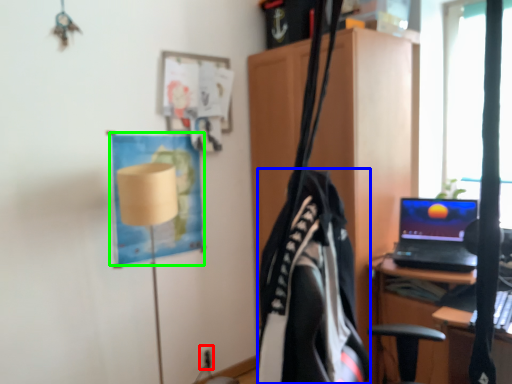
Question: Which is nearer to the electric outlet (highlighted by a red box)? clothing (highlighted by a blue box) or poster (highlighted by a green box).

Choices:
 (A) clothing
 (B) poster

Answer: (B)